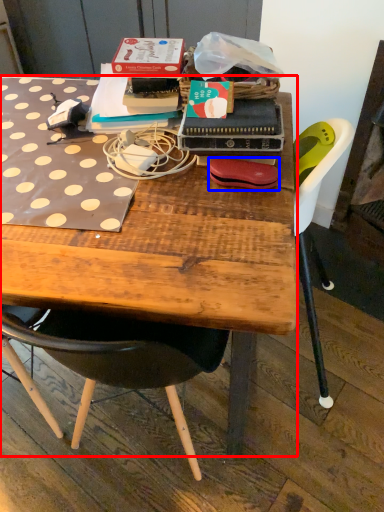
Question: Which object appears closest to the camera in this image, desk (highlighted by a red box) or handbag (highlighted by a blue box)?

Choices:
 (A) desk
 (B) handbag

Answer: (A)